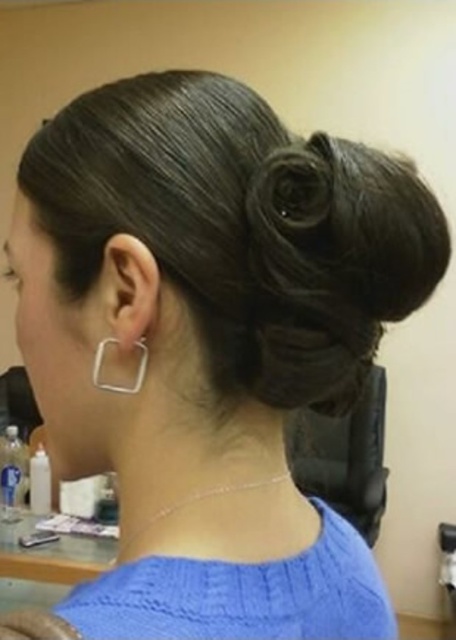
Can you confirm if dark brown hair at upper center is positioned above silver metallic square at lower left?

Incorrect, dark brown hair at upper center is not positioned above silver metallic square at lower left.

Where is `dark brown hair at upper center`? The height and width of the screenshot is (640, 456). dark brown hair at upper center is located at coordinates (35, 627).

Between point (48, 634) and point (98, 374), which one is positioned behind?

Positioned behind is point (98, 374).

The height and width of the screenshot is (640, 456). Find the location of `dark brown hair at upper center`. dark brown hair at upper center is located at coordinates (35, 627).